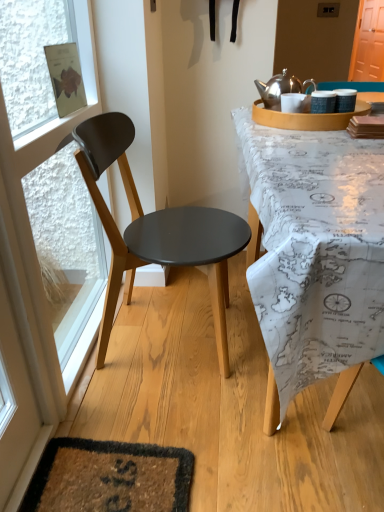
Question: From the image's perspective, does transparent glass door at left appear lower than matte black chair at left?

Choices:
 (A) yes
 (B) no

Answer: (B)

Question: Is transparent glass door at left bigger than matte black chair at left?

Choices:
 (A) no
 (B) yes

Answer: (A)

Question: Is transparent glass door at left surrounding matte black chair at left?

Choices:
 (A) no
 (B) yes

Answer: (A)

Question: Could you tell me if transparent glass door at left is turned towards matte black chair at left?

Choices:
 (A) yes
 (B) no

Answer: (A)

Question: From a real-world perspective, is transparent glass door at left beneath matte black chair at left?

Choices:
 (A) yes
 (B) no

Answer: (B)

Question: Do you think matte black chair at left is within shiny metallic kettle at upper right, or outside of it?

Choices:
 (A) inside
 (B) outside

Answer: (B)

Question: Considering the positions of matte black chair at left and shiny metallic kettle at upper right in the image, is matte black chair at left taller or shorter than shiny metallic kettle at upper right?

Choices:
 (A) tall
 (B) short

Answer: (A)

Question: Considering the positions of matte black chair at left and shiny metallic kettle at upper right in the image, is matte black chair at left bigger or smaller than shiny metallic kettle at upper right?

Choices:
 (A) small
 (B) big

Answer: (B)

Question: Would you say matte black chair at left is to the left or to the right of shiny metallic kettle at upper right in the picture?

Choices:
 (A) left
 (B) right

Answer: (A)

Question: Considering the relative positions of shiny metallic kettle at upper right and orange wood screen door at upper right in the image provided, is shiny metallic kettle at upper right to the left or to the right of orange wood screen door at upper right?

Choices:
 (A) left
 (B) right

Answer: (A)

Question: From the image's perspective, is shiny metallic kettle at upper right located above or below orange wood screen door at upper right?

Choices:
 (A) below
 (B) above

Answer: (A)

Question: In terms of width, does shiny metallic kettle at upper right look wider or thinner when compared to orange wood screen door at upper right?

Choices:
 (A) wide
 (B) thin

Answer: (A)

Question: In the image, is shiny metallic kettle at upper right positioned in front of or behind orange wood screen door at upper right?

Choices:
 (A) behind
 (B) front

Answer: (B)

Question: Relative to matte black chair at left, is orange wood screen door at upper right in front or behind?

Choices:
 (A) behind
 (B) front

Answer: (A)

Question: Is point (382, 67) positioned closer to the camera than point (231, 215)?

Choices:
 (A) farther
 (B) closer

Answer: (A)